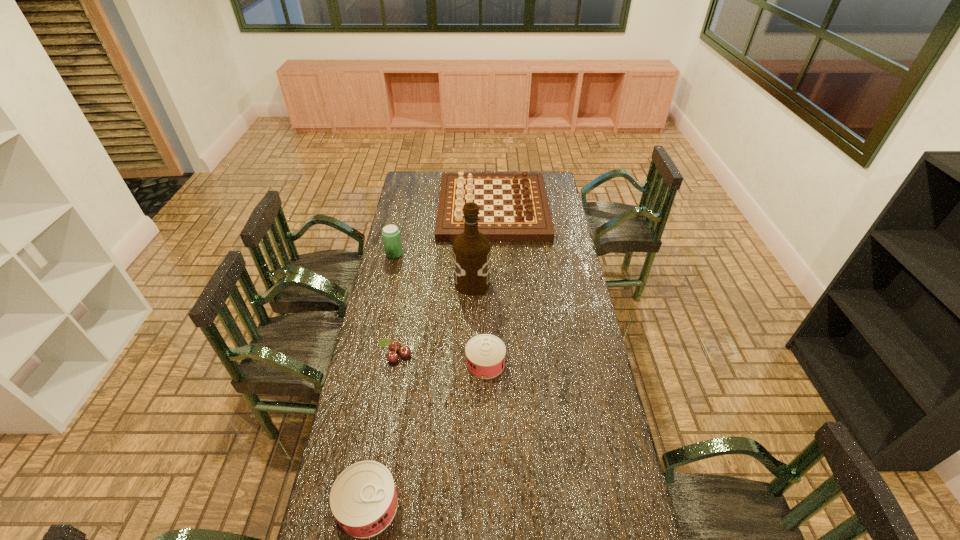
The width and height of the screenshot is (960, 540). Identify the location of the left can. (363, 499).

Where is `the nearer can`? Image resolution: width=960 pixels, height=540 pixels. the nearer can is located at coordinates (363, 499).

Locate an element on the screen. The width and height of the screenshot is (960, 540). the shorter can is located at coordinates (485, 354).

Image resolution: width=960 pixels, height=540 pixels. In order to click on the farther can in this screenshot , I will do coord(485,354).

Find the location of a particular element. The image size is (960, 540). gameboard is located at coordinates (525, 215).

The image size is (960, 540). I want to click on soda, so click(391, 236).

At what (x,y) coordinates should I click in order to perform the action: click on the tallest object. Please return your answer as a coordinate pair (x, y). This screenshot has height=540, width=960. Looking at the image, I should click on (471, 250).

Identify the location of alcohol. (471, 250).

This screenshot has width=960, height=540. I want to click on cherry, so click(404, 351).

Identify the location of vacant area situated 0.200m on the back of the left can. The width and height of the screenshot is (960, 540). (384, 416).